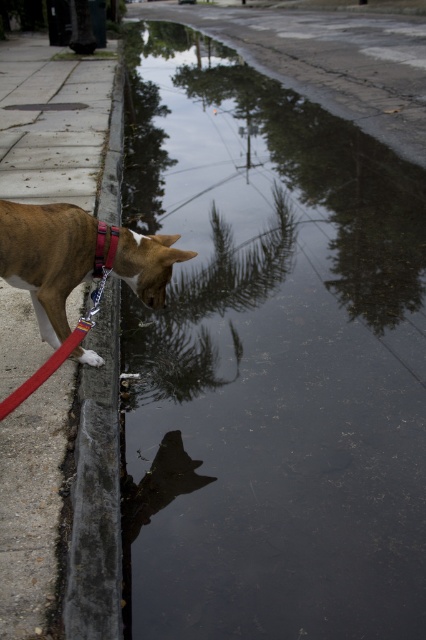
You are a photographer trying to capture the reflection of the brown matte dog at left in the glossy reflective water at lower center. Since the water is wider than the dog, will the reflection of the dog fit entirely within the water?

The glossy reflective water at lower center is wider than the brown matte dog at left, so the reflection of the dog will fit entirely within the water.

You are walking your brown matte dog at left and notice a concrete at left. Which object is positioned to the left of the other?

The concrete at left is to the left of the brown matte dog at left.